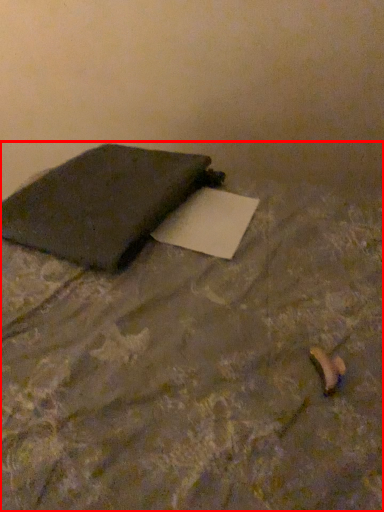
Question: From the image, what is the correct spatial relationship of furniture (annotated by the red box) in relation to notebook?

Choices:
 (A) left
 (B) right

Answer: (B)